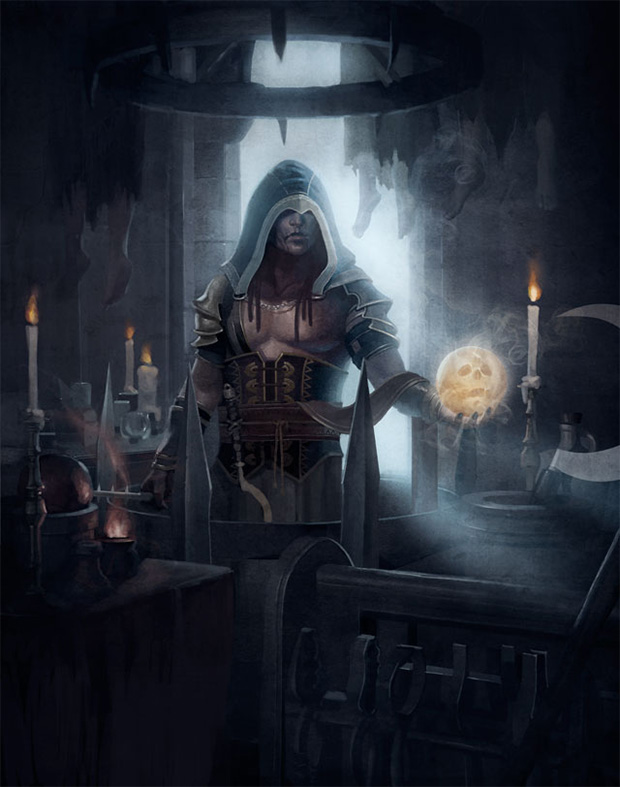
At what (x,y) coordinates should I click in order to perform the action: click on ceiling. Please return your answer as a coordinate pair (x, y). Looking at the image, I should click on (293, 97).